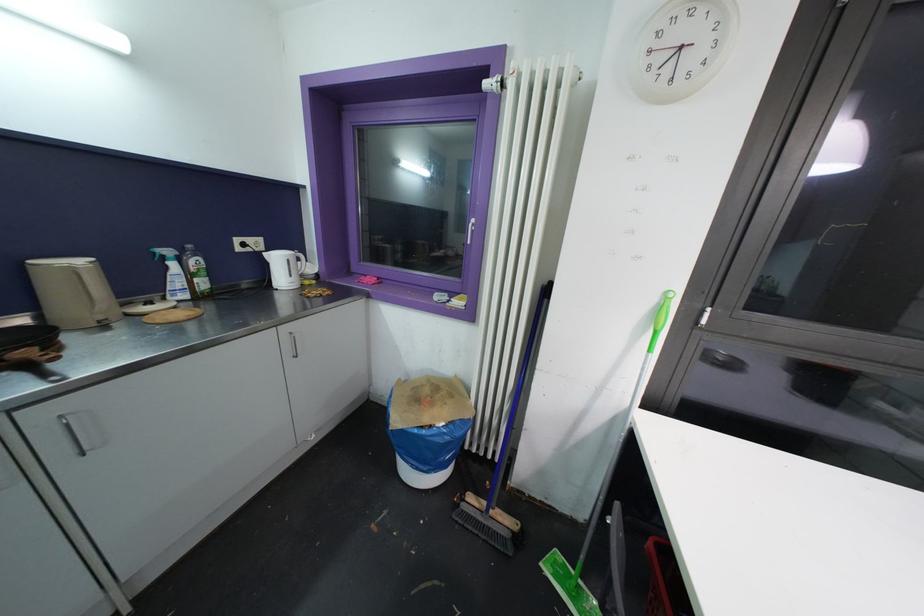
Identify the location of white kettle handle. The image size is (924, 616). (299, 254).